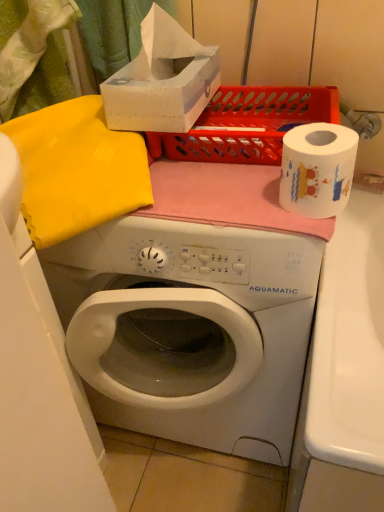
Question: Should I look upward or downward to see white paper at right?

Choices:
 (A) down
 (B) up

Answer: (B)

Question: Could you tell me if white paper at right is turned towards matte plastic crate at upper center?

Choices:
 (A) no
 (B) yes

Answer: (A)

Question: Is white paper at right turned away from matte plastic crate at upper center?

Choices:
 (A) no
 (B) yes

Answer: (B)

Question: Is white paper at right not near matte plastic crate at upper center?

Choices:
 (A) no
 (B) yes

Answer: (A)

Question: From the image's perspective, is white paper at right on matte plastic crate at upper center?

Choices:
 (A) no
 (B) yes

Answer: (A)

Question: Considering the relative positions of white paper at right and matte plastic crate at upper center in the image provided, is white paper at right behind matte plastic crate at upper center?

Choices:
 (A) no
 (B) yes

Answer: (A)

Question: Are white paper at right and matte plastic crate at upper center making contact?

Choices:
 (A) no
 (B) yes

Answer: (A)

Question: From the image's perspective, is matte plastic crate at upper center located above white paper at right?

Choices:
 (A) yes
 (B) no

Answer: (A)

Question: Is matte plastic crate at upper center far away from white paper at right?

Choices:
 (A) yes
 (B) no

Answer: (B)

Question: Is matte plastic crate at upper center to the left of white paper at right from the viewer's perspective?

Choices:
 (A) yes
 (B) no

Answer: (A)

Question: Considering the relative sizes of matte plastic crate at upper center and white paper at right in the image provided, is matte plastic crate at upper center shorter than white paper at right?

Choices:
 (A) no
 (B) yes

Answer: (B)

Question: Is matte plastic crate at upper center looking in the opposite direction of white paper at right?

Choices:
 (A) yes
 (B) no

Answer: (B)

Question: Considering the relative sizes of matte plastic crate at upper center and white paper at right in the image provided, is matte plastic crate at upper center wider than white paper at right?

Choices:
 (A) yes
 (B) no

Answer: (A)

Question: Is white cardboard tissue box at upper center inside matte plastic crate at upper center?

Choices:
 (A) yes
 (B) no

Answer: (B)